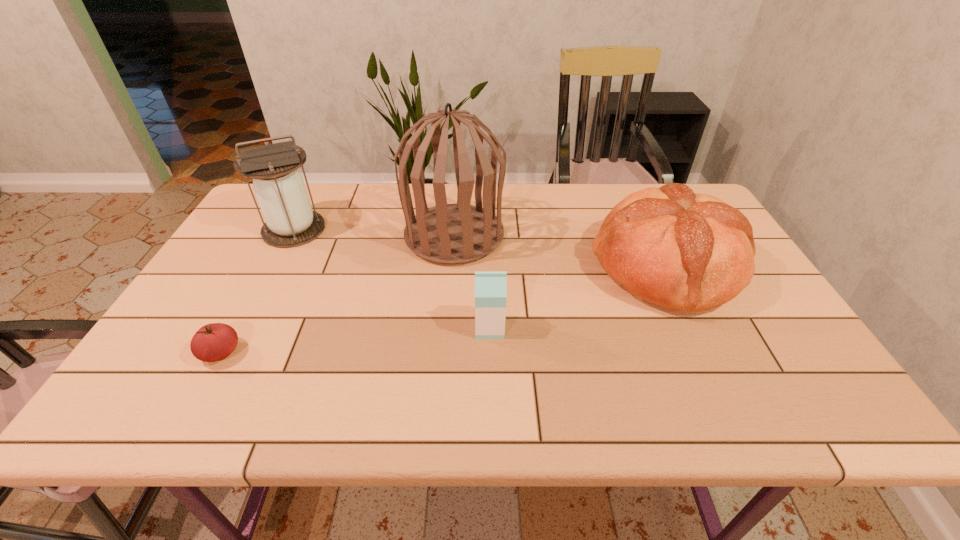
The height and width of the screenshot is (540, 960). I want to click on free space located 0.330m on the right of the shortest object, so click(x=390, y=353).

The height and width of the screenshot is (540, 960). What are the coordinates of `birdcage at the far edge` in the screenshot? It's located at (x=458, y=233).

Find the location of a particular element. This screenshot has height=540, width=960. lantern at the far edge is located at coordinates (289, 220).

Locate an element on the screen. The width and height of the screenshot is (960, 540). bread located in the far edge section of the desktop is located at coordinates (689, 252).

The image size is (960, 540). What are the coordinates of `lantern at the left edge` in the screenshot? It's located at (289, 220).

The height and width of the screenshot is (540, 960). What are the coordinates of `tomato at the left edge` in the screenshot? It's located at (212, 342).

I want to click on object present at the right edge, so click(689, 252).

Where is `object that is at the far left corner`? Image resolution: width=960 pixels, height=540 pixels. object that is at the far left corner is located at coordinates (289, 220).

At what (x,y) coordinates should I click in order to perform the action: click on object that is positioned at the far right corner. Please return your answer as a coordinate pair (x, y). Looking at the image, I should click on (689, 252).

In the image, there is a desktop. Where is `vacant space at the far edge`? This screenshot has height=540, width=960. vacant space at the far edge is located at coordinates (567, 183).